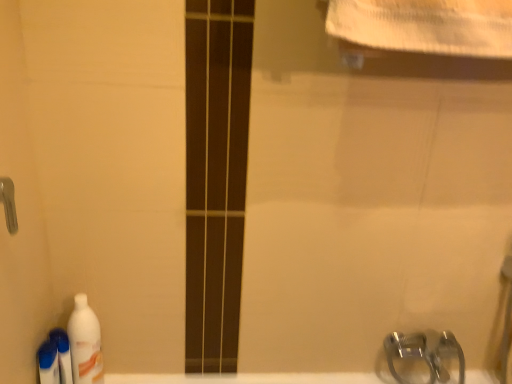
Question: Can you confirm if white glossy bottle at lower left, which ranks as the third cleaning product in left-to-right order, is thinner than white glossy bath at lower center?

Choices:
 (A) no
 (B) yes

Answer: (A)

Question: From a real-world perspective, is white glossy bottle at lower left, which ranks as the first cleaning product in right-to-left order, on top of white glossy bath at lower center?

Choices:
 (A) no
 (B) yes

Answer: (B)

Question: Is white glossy bottle at lower left, which ranks as the first cleaning product in right-to-left order, at the left side of white glossy bath at lower center?

Choices:
 (A) no
 (B) yes

Answer: (B)

Question: Can you confirm if white glossy bottle at lower left, which ranks as the third cleaning product in left-to-right order, is shorter than white glossy bath at lower center?

Choices:
 (A) no
 (B) yes

Answer: (A)

Question: Could you tell me if white glossy bottle at lower left, which ranks as the third cleaning product in left-to-right order, is turned towards white glossy bath at lower center?

Choices:
 (A) yes
 (B) no

Answer: (A)

Question: In terms of size, does white glossy bottle at lower left, which ranks as the first cleaning product in right-to-left order, appear bigger or smaller than white glossy bath at lower center?

Choices:
 (A) small
 (B) big

Answer: (A)

Question: In the image, is white glossy bottle at lower left, which ranks as the first cleaning product in right-to-left order, positioned in front of or behind white glossy bath at lower center?

Choices:
 (A) front
 (B) behind

Answer: (A)

Question: From a real-world perspective, is white glossy bottle at lower left, which ranks as the third cleaning product in left-to-right order, positioned above or below white glossy bath at lower center?

Choices:
 (A) below
 (B) above

Answer: (B)

Question: Considering the relative positions of white glossy bottle at lower left, which ranks as the first cleaning product in right-to-left order, and white glossy bath at lower center in the image provided, is white glossy bottle at lower left, which ranks as the first cleaning product in right-to-left order, to the left or to the right of white glossy bath at lower center?

Choices:
 (A) left
 (B) right

Answer: (A)

Question: Is white glossy bottle at lower left, which ranks as the first cleaning product in right-to-left order, to the left or to the right of translucent plastic bottle at lower left, the 1th cleaning product in the left-to-right sequence, in the image?

Choices:
 (A) right
 (B) left

Answer: (A)

Question: Considering the positions of white glossy bottle at lower left, which ranks as the third cleaning product in left-to-right order, and translucent plastic bottle at lower left, the 3th cleaning product positioned from the right, in the image, is white glossy bottle at lower left, which ranks as the third cleaning product in left-to-right order, wider or thinner than translucent plastic bottle at lower left, the 3th cleaning product positioned from the right,?

Choices:
 (A) thin
 (B) wide

Answer: (B)

Question: Based on their sizes in the image, would you say white glossy bottle at lower left, which ranks as the first cleaning product in right-to-left order, is bigger or smaller than translucent plastic bottle at lower left, the 3th cleaning product positioned from the right?

Choices:
 (A) big
 (B) small

Answer: (A)

Question: Is white glossy bottle at lower left, which ranks as the first cleaning product in right-to-left order, inside or outside of translucent plastic bottle at lower left, the 3th cleaning product positioned from the right?

Choices:
 (A) inside
 (B) outside

Answer: (B)

Question: In the image, is white glossy bottle at lower left, which ranks as the first cleaning product in right-to-left order, positioned in front of or behind white glossy bottle at lower left, which is the second cleaning product from right to left?

Choices:
 (A) behind
 (B) front

Answer: (B)

Question: In terms of width, does white glossy bottle at lower left, which ranks as the first cleaning product in right-to-left order, look wider or thinner when compared to white glossy bottle at lower left, the second cleaning product in the left-to-right sequence?

Choices:
 (A) wide
 (B) thin

Answer: (A)